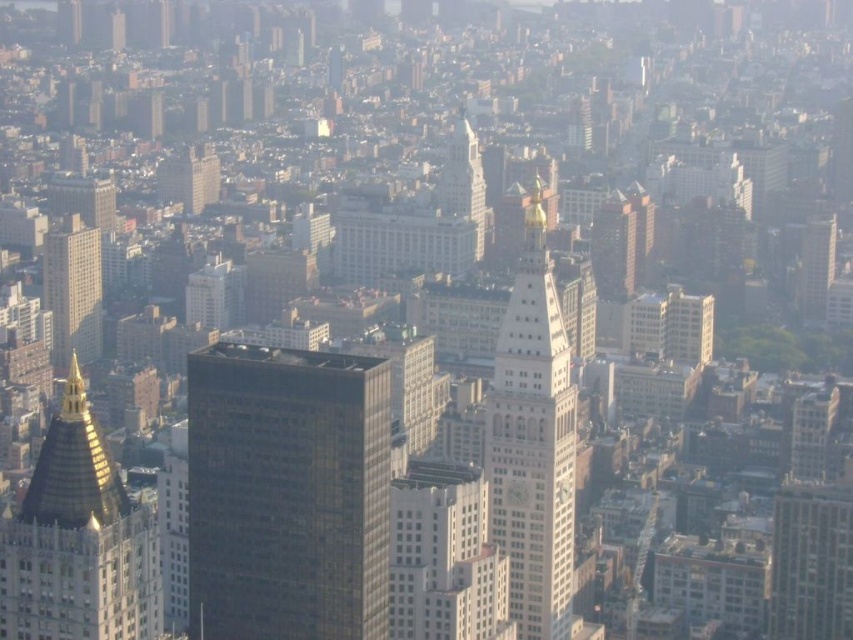
Who is taller, gold-tipped stone clock tower at center or white stone tower at center?

Standing taller between the two is gold-tipped stone clock tower at center.

Which is in front, point (544, 300) or point (476, 164)?

Positioned in front is point (544, 300).

You are a GUI agent. You are given a task and a screenshot of the screen. Output one action in this format:
    pyautogui.click(x=<x>, y=<y>)
    Task: Click on the gold-tipped stone clock tower at center
    The width and height of the screenshot is (853, 640).
    Given the screenshot: What is the action you would take?
    pyautogui.click(x=532, y=444)

Is gold metallic dome at left taller than white matte building at upper center?

Yes.

The width and height of the screenshot is (853, 640). I want to click on gold metallic dome at left, so click(x=78, y=541).

This screenshot has width=853, height=640. Describe the element at coordinates (78, 541) in the screenshot. I see `gold metallic dome at left` at that location.

Where is `gold metallic dome at left`? gold metallic dome at left is located at coordinates (78, 541).

Can you confirm if gold metallic dome at left is positioned to the left of white stone tower at center?

Correct, you'll find gold metallic dome at left to the left of white stone tower at center.

Is gold metallic dome at left wider than white stone tower at center?

Indeed, gold metallic dome at left has a greater width compared to white stone tower at center.

Is point (45, 436) more distant than point (450, 136)?

That is True.

Locate an element on the screen. The width and height of the screenshot is (853, 640). gold metallic dome at left is located at coordinates (78, 541).